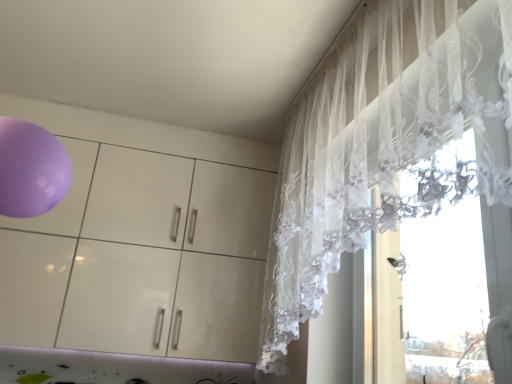
Question: Considering the positions of glossy white dresser at upper left and white lace curtain at right in the image, is glossy white dresser at upper left wider or thinner than white lace curtain at right?

Choices:
 (A) wide
 (B) thin

Answer: (A)

Question: From a real-world perspective, relative to white lace curtain at right, is glossy white dresser at upper left vertically above or below?

Choices:
 (A) below
 (B) above

Answer: (A)

Question: From the image's perspective, relative to white lace curtain at right, is glossy white dresser at upper left above or below?

Choices:
 (A) above
 (B) below

Answer: (B)

Question: Is white lace curtain at right in front of or behind glossy white dresser at upper left in the image?

Choices:
 (A) front
 (B) behind

Answer: (A)

Question: Is white lace curtain at right to the left or to the right of glossy white dresser at upper left in the image?

Choices:
 (A) left
 (B) right

Answer: (B)

Question: Is point (284, 145) closer or farther from the camera than point (269, 208)?

Choices:
 (A) farther
 (B) closer

Answer: (B)

Question: Looking at their shapes, would you say white lace curtain at right is wider or thinner than glossy white dresser at upper left?

Choices:
 (A) wide
 (B) thin

Answer: (B)